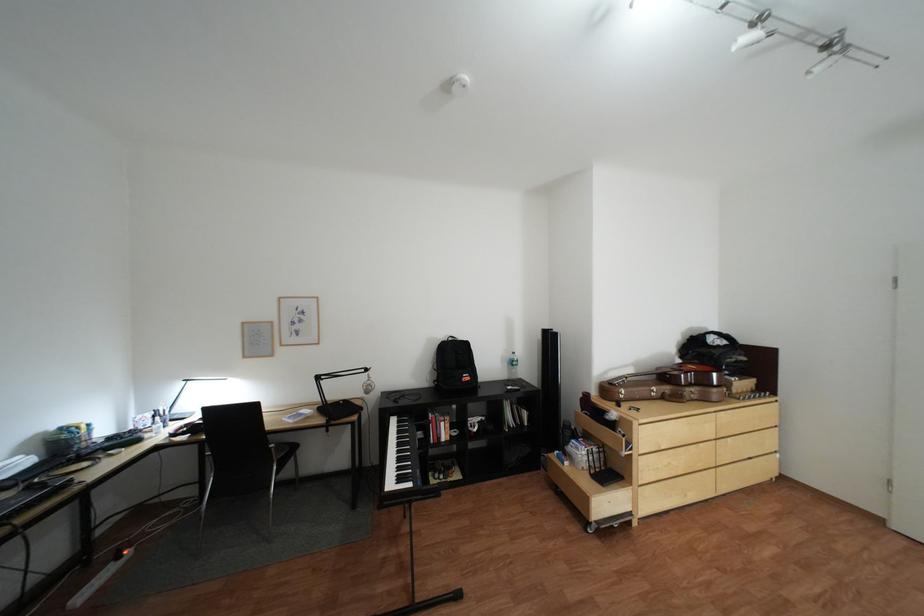
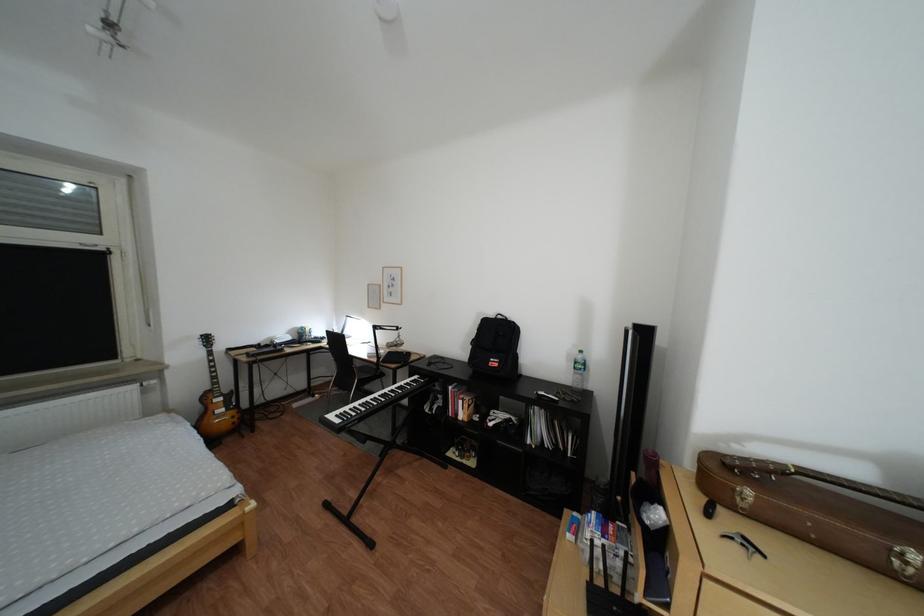
Where in the second image is the point corresponding to point 481,379 from the first image?

(509, 363)